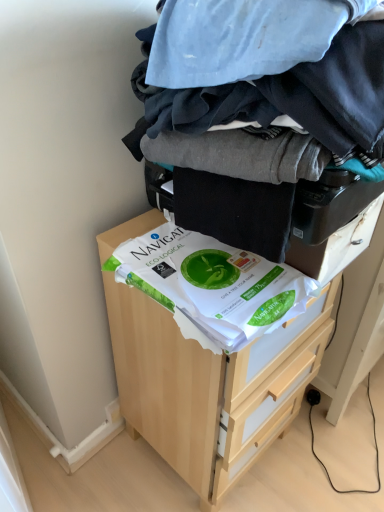
Question: Is dark blue cotton laundry at center smaller than white paper at center?

Choices:
 (A) yes
 (B) no

Answer: (B)

Question: Is dark blue cotton laundry at center bigger than white paper at center?

Choices:
 (A) yes
 (B) no

Answer: (A)

Question: Can you confirm if dark blue cotton laundry at center is wider than white paper at center?

Choices:
 (A) yes
 (B) no

Answer: (A)

Question: Considering the relative sizes of dark blue cotton laundry at center and white paper at center in the image provided, is dark blue cotton laundry at center shorter than white paper at center?

Choices:
 (A) yes
 (B) no

Answer: (B)

Question: Is dark blue cotton laundry at center not close to white paper at center?

Choices:
 (A) yes
 (B) no

Answer: (B)

Question: Looking at the image, does white paper at center seem bigger or smaller compared to light wood chest of drawers at center?

Choices:
 (A) small
 (B) big

Answer: (A)

Question: In the image, is white paper at center positioned in front of or behind light wood chest of drawers at center?

Choices:
 (A) behind
 (B) front

Answer: (B)

Question: Is point (196, 276) positioned closer to the camera than point (258, 355)?

Choices:
 (A) closer
 (B) farther

Answer: (A)

Question: From the image's perspective, relative to light wood chest of drawers at center, is white paper at center above or below?

Choices:
 (A) below
 (B) above

Answer: (B)

Question: From the image's perspective, relative to dark blue cotton laundry at center, is white paper at center above or below?

Choices:
 (A) above
 (B) below

Answer: (B)

Question: Considering the relative positions of white paper at center and dark blue cotton laundry at center in the image provided, is white paper at center to the left or to the right of dark blue cotton laundry at center?

Choices:
 (A) right
 (B) left

Answer: (B)

Question: Is white paper at center in front of or behind dark blue cotton laundry at center in the image?

Choices:
 (A) front
 (B) behind

Answer: (B)

Question: Would you say white paper at center is inside or outside dark blue cotton laundry at center?

Choices:
 (A) inside
 (B) outside

Answer: (B)

Question: Considering the positions of light wood chest of drawers at center and white paper at center in the image, is light wood chest of drawers at center bigger or smaller than white paper at center?

Choices:
 (A) big
 (B) small

Answer: (A)

Question: Considering the positions of light wood chest of drawers at center and white paper at center in the image, is light wood chest of drawers at center wider or thinner than white paper at center?

Choices:
 (A) thin
 (B) wide

Answer: (B)